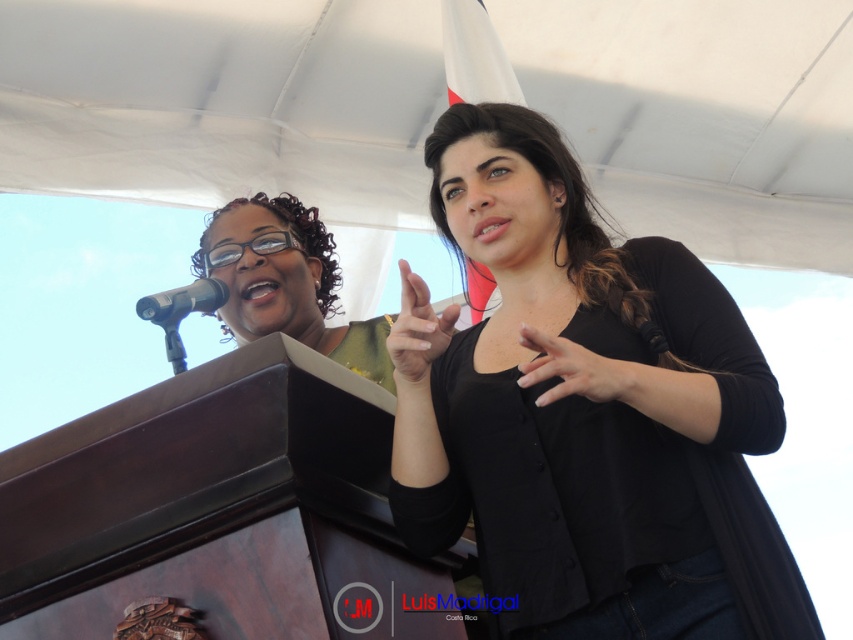
Consider the image. Who is positioned more to the right, matte black shirt at upper center or silver metallic microphone at left?

matte black shirt at upper center is more to the right.

Can you confirm if matte black shirt at upper center is positioned below silver metallic microphone at left?

Yes, matte black shirt at upper center is below silver metallic microphone at left.

Describe the element at coordinates (287, 282) in the screenshot. I see `matte black shirt at upper center` at that location.

Where is `matte black shirt at upper center`? matte black shirt at upper center is located at coordinates (287, 282).

The width and height of the screenshot is (853, 640). Find the location of `black matte cardigan at center`. black matte cardigan at center is located at coordinates (589, 412).

Measure the distance between black matte cardigan at center and camera.

black matte cardigan at center and camera are 2.28 meters apart.

Locate an element on the screen. The image size is (853, 640). black matte cardigan at center is located at coordinates (589, 412).

Does black matte cardigan at center appear on the right side of matte black shirt at upper center?

Indeed, black matte cardigan at center is positioned on the right side of matte black shirt at upper center.

Who is positioned more to the left, black matte cardigan at center or matte black shirt at upper center?

matte black shirt at upper center is more to the left.

Identify the location of black matte cardigan at center. (589, 412).

Where is `black matte cardigan at center`? Image resolution: width=853 pixels, height=640 pixels. black matte cardigan at center is located at coordinates (589, 412).